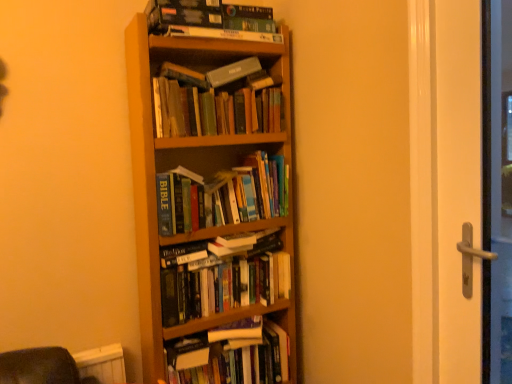
Question: Is hardcover books at center, the 2th book when ordered from bottom to top, directly adjacent to hardcover gray book at upper center?

Choices:
 (A) no
 (B) yes

Answer: (A)

Question: Is hardcover books at center, the 5th book in the top-to-bottom sequence, not near hardcover gray book at upper center?

Choices:
 (A) no
 (B) yes

Answer: (A)

Question: Is hardcover books at center, the 2th book when ordered from bottom to top, wider than hardcover gray book at upper center?

Choices:
 (A) yes
 (B) no

Answer: (A)

Question: Is hardcover books at center, the 2th book when ordered from bottom to top, to the right of hardcover gray book at upper center from the viewer's perspective?

Choices:
 (A) yes
 (B) no

Answer: (B)

Question: Is hardcover books at center, the 2th book when ordered from bottom to top, positioned with its back to hardcover gray book at upper center?

Choices:
 (A) yes
 (B) no

Answer: (B)

Question: Would you say hardcover books at center, the 3th book when ordered from top to bottom, is to the left or to the right of wooden bookcase at center in the picture?

Choices:
 (A) right
 (B) left

Answer: (A)

Question: Is point (164, 183) closer or farther from the camera than point (276, 339)?

Choices:
 (A) farther
 (B) closer

Answer: (B)

Question: In terms of width, does hardcover books at center, the 4th book when ordered from bottom to top, look wider or thinner when compared to wooden bookcase at center?

Choices:
 (A) wide
 (B) thin

Answer: (B)

Question: Is hardcover books at center, the 3th book when ordered from top to bottom, in front of or behind wooden bookcase at center in the image?

Choices:
 (A) behind
 (B) front

Answer: (A)

Question: Is point (228, 339) closer or farther from the camera than point (247, 74)?

Choices:
 (A) farther
 (B) closer

Answer: (B)

Question: From their relative heights in the image, would you say wooden bookcase at center is taller or shorter than hardcover gray book at upper center?

Choices:
 (A) short
 (B) tall

Answer: (B)

Question: Considering their positions, is wooden bookcase at center located in front of or behind hardcover gray book at upper center?

Choices:
 (A) front
 (B) behind

Answer: (A)

Question: Is wooden bookcase at center situated inside hardcover gray book at upper center or outside?

Choices:
 (A) outside
 (B) inside

Answer: (A)

Question: Is wooden bookcase at center bigger or smaller than hardcover book at upper center, marked as the first book in a top-to-bottom arrangement?

Choices:
 (A) big
 (B) small

Answer: (A)

Question: From a real-world perspective, is wooden bookcase at center above or below hardcover book at upper center, marked as the first book in a top-to-bottom arrangement?

Choices:
 (A) above
 (B) below

Answer: (B)